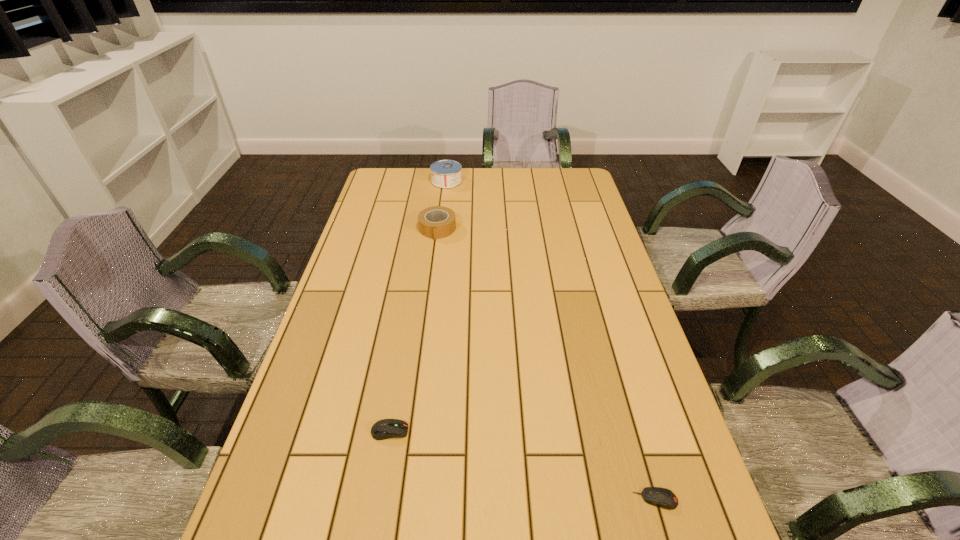
Where is `vacant space that satisfies the following two spatial constraints: 1. on the back side of the shortest object; 2. on the button of the farther computer mouse`? The image size is (960, 540). vacant space that satisfies the following two spatial constraints: 1. on the back side of the shortest object; 2. on the button of the farther computer mouse is located at coordinates (636, 431).

At what (x,y) coordinates should I click in order to perform the action: click on vacant space that satisfies the following two spatial constraints: 1. at the edge of the third shortest object; 2. on the button of the third tallest object. Please return your answer as a coordinate pair (x, y). The height and width of the screenshot is (540, 960). Looking at the image, I should click on (412, 431).

I want to click on free spot that satisfies the following two spatial constraints: 1. at the edge of the duct tape; 2. on the right side of the nearer computer mouse, so click(403, 499).

The image size is (960, 540). I want to click on blank area in the image that satisfies the following two spatial constraints: 1. at the edge of the duct tape; 2. on the button of the taller computer mouse, so pos(412,431).

This screenshot has width=960, height=540. I want to click on vacant area that satisfies the following two spatial constraints: 1. on the button of the rightmost object; 2. on the left side of the left computer mouse, so click(378, 499).

This screenshot has height=540, width=960. I want to click on free space that satisfies the following two spatial constraints: 1. on the front side of the rightmost object; 2. on the left side of the tallest object, so click(410, 499).